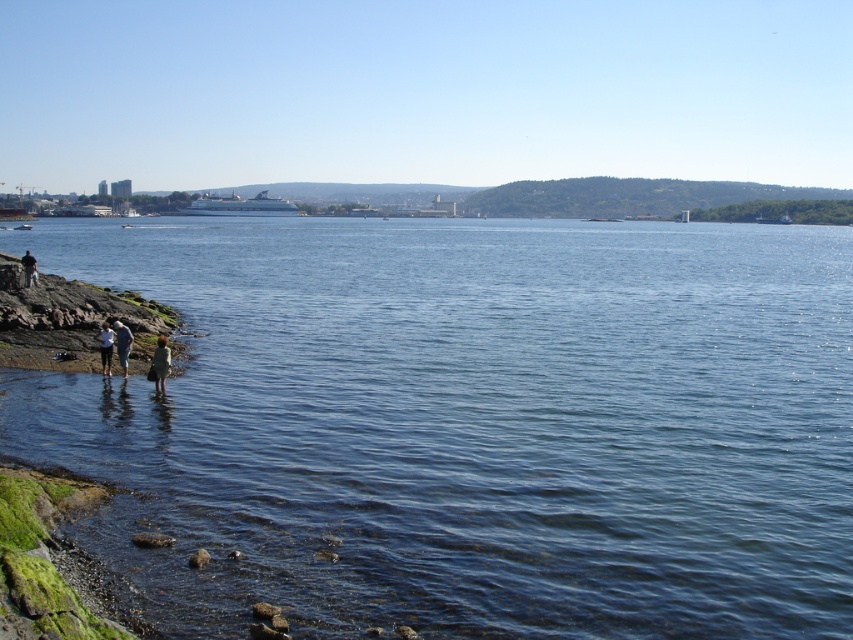
You are a photographer standing at the edge of the rocky shoreline in the coastal scene. You want to take a photo that includes both the cruise ship in the distance and the people near the water. Which of the two points, point 1 at coordinates point [268,529] or point 2 at coordinates point [167,355], is closer to your current position?

Point 1 at coordinates point [268,529] is closer to the photographer since it is closer to the camera than point 2 at coordinates point [167,355].

You are standing at the shoreline looking out towards the cruise ship. There are two points marked on your map, one at coordinates point (115, 332) and another at point (22, 259). Which point is physically closer to you?

Point (115, 332) is closer to the camera than point (22, 259), so the point at coordinates point (115, 332) is physically closer to you.